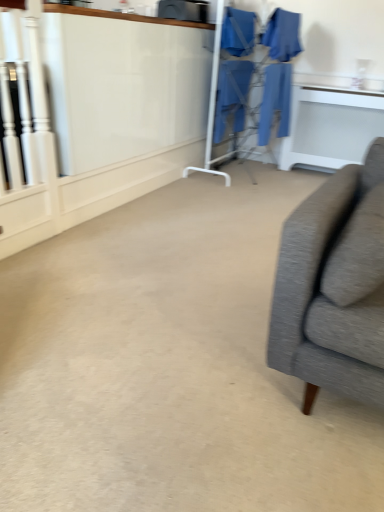
Question: Does blue fabric robe at center, acting as the 4th robe starting from the left, turn towards blue fabric robe at center, marked as the 1th robe in a left-to-right arrangement?

Choices:
 (A) yes
 (B) no

Answer: (B)

Question: Can you confirm if blue fabric robe at center, which appears as the 1th robe when viewed from the right, is thinner than blue fabric robe at center, marked as the 1th robe in a left-to-right arrangement?

Choices:
 (A) no
 (B) yes

Answer: (B)

Question: Does blue fabric robe at center, acting as the 4th robe starting from the left, touch blue fabric robe at center, marked as the 1th robe in a left-to-right arrangement?

Choices:
 (A) no
 (B) yes

Answer: (A)

Question: Is blue fabric robe at center, which appears as the 1th robe when viewed from the right, far away from blue fabric robe at center, the 4th robe when ordered from right to left?

Choices:
 (A) yes
 (B) no

Answer: (B)

Question: Is blue fabric robe at center, acting as the 4th robe starting from the left, closer to the viewer compared to blue fabric robe at center, marked as the 1th robe in a left-to-right arrangement?

Choices:
 (A) no
 (B) yes

Answer: (B)

Question: In terms of size, does blue fabric robe at center, the third robe when ordered from right to left, appear bigger or smaller than white glossy table at upper right?

Choices:
 (A) small
 (B) big

Answer: (A)

Question: Do you think blue fabric robe at center, the third robe when ordered from right to left, is within white glossy table at upper right, or outside of it?

Choices:
 (A) inside
 (B) outside

Answer: (B)

Question: In terms of width, does blue fabric robe at center, the second robe positioned from the left, look wider or thinner when compared to white glossy table at upper right?

Choices:
 (A) thin
 (B) wide

Answer: (A)

Question: Visually, is blue fabric robe at center, the third robe when ordered from right to left, positioned to the left or to the right of white glossy table at upper right?

Choices:
 (A) right
 (B) left

Answer: (B)

Question: Considering the positions of blue fabric robe at center, the 4th robe when ordered from right to left, and blue fabric laundry at center in the image, is blue fabric robe at center, the 4th robe when ordered from right to left, bigger or smaller than blue fabric laundry at center?

Choices:
 (A) small
 (B) big

Answer: (A)

Question: Is blue fabric robe at center, marked as the 1th robe in a left-to-right arrangement, taller or shorter than blue fabric laundry at center?

Choices:
 (A) tall
 (B) short

Answer: (B)

Question: Considering their positions, is blue fabric robe at center, marked as the 1th robe in a left-to-right arrangement, located in front of or behind blue fabric laundry at center?

Choices:
 (A) behind
 (B) front

Answer: (A)

Question: From the image's perspective, is blue fabric robe at center, marked as the 1th robe in a left-to-right arrangement, located above or below blue fabric laundry at center?

Choices:
 (A) above
 (B) below

Answer: (A)

Question: Is point (223, 32) positioned closer to the camera than point (218, 138)?

Choices:
 (A) farther
 (B) closer

Answer: (B)

Question: From the image's perspective, relative to blue fabric robe at center, the second robe positioned from the left, is blue fabric robe at center, the 4th robe when ordered from right to left, above or below?

Choices:
 (A) below
 (B) above

Answer: (B)